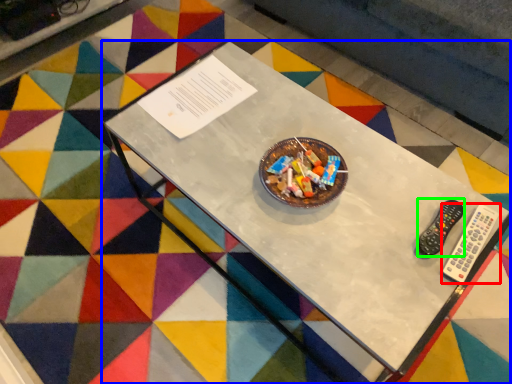
Question: Which object is positioned farthest from remote control (highlighted by a red box)? Select from table (highlighted by a blue box) and control (highlighted by a green box).

Choices:
 (A) table
 (B) control

Answer: (A)